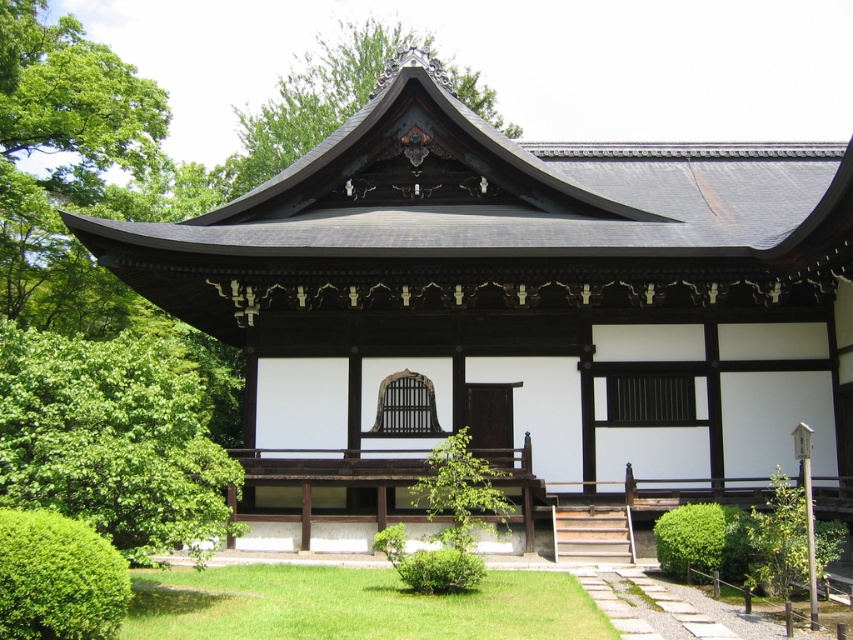
Question: Does green leafy tree at lower left have a greater width compared to green leafy tree at upper center?

Choices:
 (A) no
 (B) yes

Answer: (A)

Question: Where is green leafy tree at lower left located in relation to green leafy tree at upper center in the image?

Choices:
 (A) left
 (B) right

Answer: (A)

Question: Can you confirm if green leafy tree at lower left is positioned above green leafy tree at upper center?

Choices:
 (A) no
 (B) yes

Answer: (A)